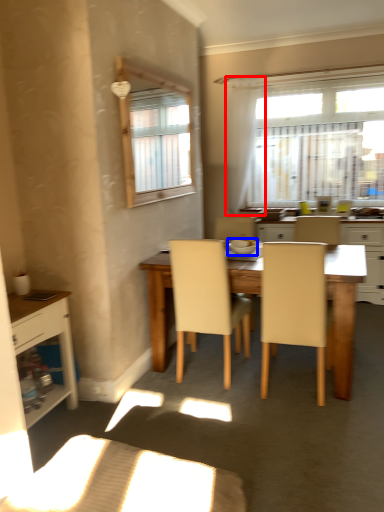
Question: Which point is further to the camera, curtain (highlighted by a red box) or tableware (highlighted by a blue box)?

Choices:
 (A) curtain
 (B) tableware

Answer: (A)